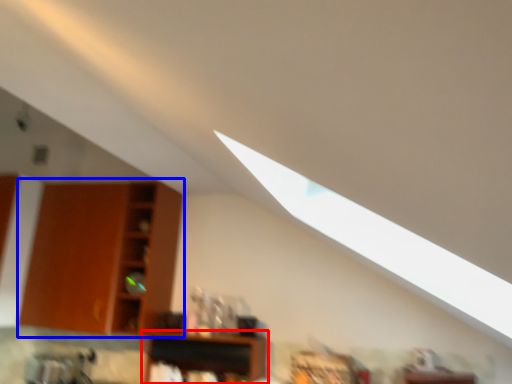
Question: Which of the following is the closest to the observer, shelf (highlighted by a red box) or shelf (highlighted by a blue box)?

Choices:
 (A) shelf
 (B) shelf

Answer: (A)